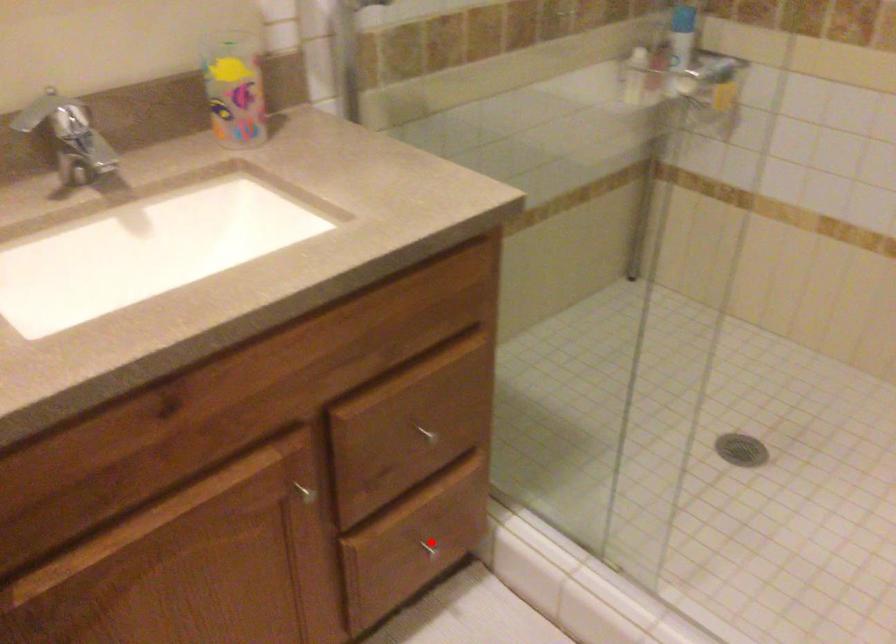
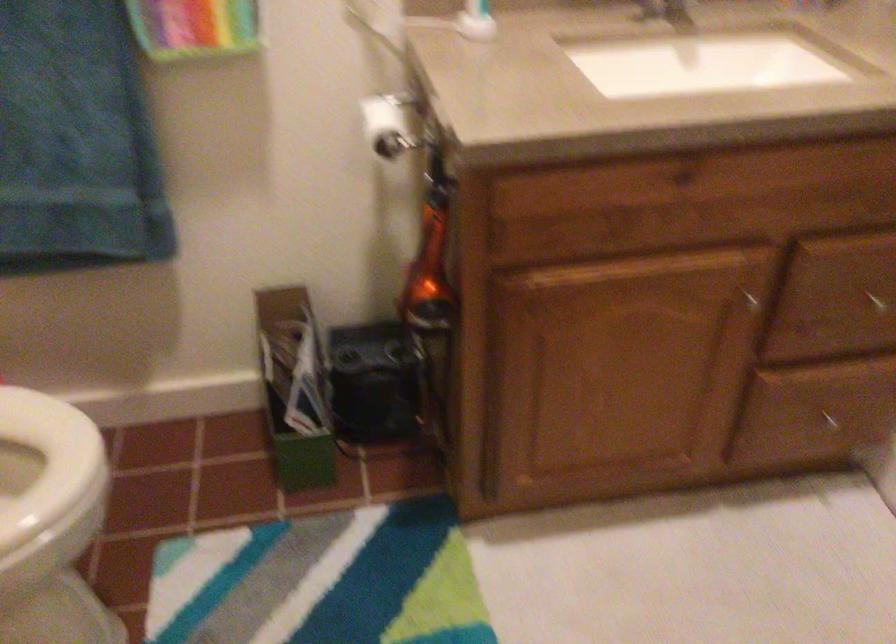
Find the pixel in the second image that matches the highlighted location in the first image.

(831, 422)